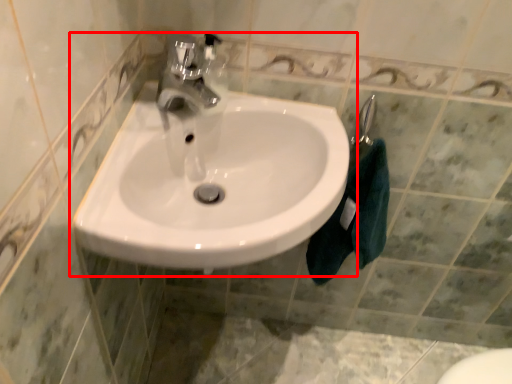
Question: From the image, what is the correct spatial relationship of sink (annotated by the red box) in relation to bath towel?

Choices:
 (A) left
 (B) right

Answer: (A)